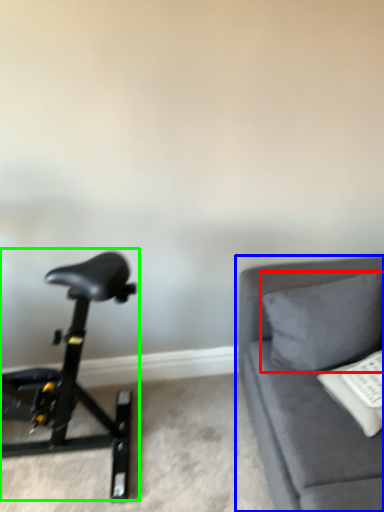
Question: Based on their relative distances, which object is nearer to pillow (highlighted by a red box)? Choose from studio couch (highlighted by a blue box) and stationary bicycle (highlighted by a green box).

Choices:
 (A) studio couch
 (B) stationary bicycle

Answer: (A)